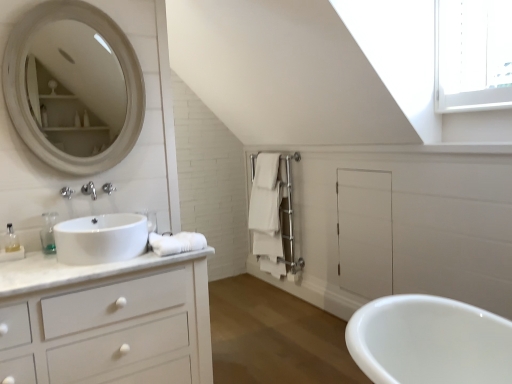
Question: From a real-world perspective, is white matte cabinet at left on translucent plastic bottle at left, which is the 2th toiletry from left to right?

Choices:
 (A) yes
 (B) no

Answer: (B)

Question: From the image's perspective, is white matte cabinet at left beneath translucent plastic bottle at left, which is the 2th toiletry from left to right?

Choices:
 (A) yes
 (B) no

Answer: (A)

Question: From a real-world perspective, is white matte cabinet at left beneath translucent plastic bottle at left, the 2th toiletry when ordered from right to left?

Choices:
 (A) yes
 (B) no

Answer: (A)

Question: Does white matte cabinet at left come behind translucent plastic bottle at left, which is the 2th toiletry from left to right?

Choices:
 (A) yes
 (B) no

Answer: (B)

Question: Is white matte cabinet at left positioned in front of translucent plastic bottle at left, which is the 2th toiletry from left to right?

Choices:
 (A) no
 (B) yes

Answer: (B)

Question: Is white glossy soap dispenser at left, the 1th toiletry from the back, to the left or to the right of white cotton bath towel at lower left, which is counted as the 2th bath towel, starting from the back, in the image?

Choices:
 (A) right
 (B) left

Answer: (B)

Question: Is white glossy soap dispenser at left, which is the first toiletry in right-to-left order, inside or outside of white cotton bath towel at lower left, which is the first bath towel in front-to-back order?

Choices:
 (A) inside
 (B) outside

Answer: (B)

Question: Relative to white cotton bath towel at lower left, which is the first bath towel in front-to-back order, is white glossy soap dispenser at left, arranged as the 3th toiletry when viewed from the front, in front or behind?

Choices:
 (A) front
 (B) behind

Answer: (B)

Question: From the image's perspective, is white glossy soap dispenser at left, which is the first toiletry in right-to-left order, above or below white cotton bath towel at lower left, the first bath towel positioned from the left?

Choices:
 (A) below
 (B) above

Answer: (B)

Question: Is white matte mirror at upper left to the left or to the right of white matte towel at center-right, which is counted as the 2th bath towel, starting from the front, in the image?

Choices:
 (A) right
 (B) left

Answer: (B)

Question: Based on their sizes in the image, would you say white matte mirror at upper left is bigger or smaller than white matte towel at center-right, which appears as the first bath towel when viewed from the top?

Choices:
 (A) big
 (B) small

Answer: (B)

Question: Considering the positions of white matte mirror at upper left and white matte towel at center-right, which is counted as the 2th bath towel, starting from the front, in the image, is white matte mirror at upper left wider or thinner than white matte towel at center-right, which is counted as the 2th bath towel, starting from the front,?

Choices:
 (A) wide
 (B) thin

Answer: (B)

Question: From a real-world perspective, is white matte mirror at upper left physically located above or below white matte towel at center-right, placed as the first bath towel when sorted from right to left?

Choices:
 (A) below
 (B) above

Answer: (B)

Question: Considering their positions, is white glossy sink at left located in front of or behind white matte towel at center-right, the second bath towel viewed from the left?

Choices:
 (A) front
 (B) behind

Answer: (A)

Question: In terms of size, does white glossy sink at left appear bigger or smaller than white matte towel at center-right, which appears as the first bath towel when viewed from the top?

Choices:
 (A) small
 (B) big

Answer: (A)